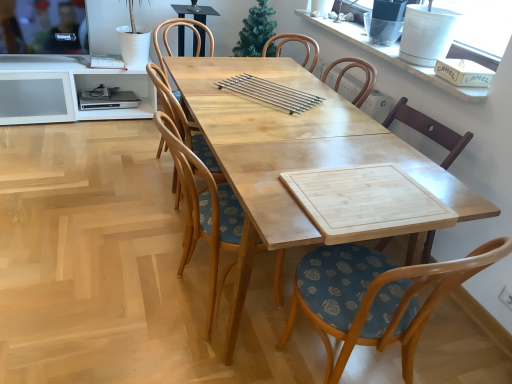
Question: Considering the relative positions of light wood table at center and white ceramic vase at upper right in the image provided, is light wood table at center to the right of white ceramic vase at upper right from the viewer's perspective?

Choices:
 (A) yes
 (B) no

Answer: (B)

Question: Is light wood table at center to the left of white ceramic vase at upper right from the viewer's perspective?

Choices:
 (A) yes
 (B) no

Answer: (A)

Question: Is light wood table at center facing away from white ceramic vase at upper right?

Choices:
 (A) yes
 (B) no

Answer: (B)

Question: Can white ceramic vase at upper right be found inside light wood table at center?

Choices:
 (A) yes
 (B) no

Answer: (B)

Question: Can you confirm if light wood table at center is shorter than white ceramic vase at upper right?

Choices:
 (A) yes
 (B) no

Answer: (B)

Question: In terms of height, does wooden chair with floral cushion at center, which appears as the 3th chair when viewed from the front, look taller or shorter compared to white ceramic vase at upper right?

Choices:
 (A) tall
 (B) short

Answer: (A)

Question: Considering the positions of wooden chair with floral cushion at center, which appears as the 3th chair when viewed from the front, and white ceramic vase at upper right in the image, is wooden chair with floral cushion at center, which appears as the 3th chair when viewed from the front, wider or thinner than white ceramic vase at upper right?

Choices:
 (A) wide
 (B) thin

Answer: (A)

Question: Looking at the image, does wooden chair with floral cushion at center, which appears as the 3th chair when viewed from the front, seem bigger or smaller compared to white ceramic vase at upper right?

Choices:
 (A) big
 (B) small

Answer: (A)

Question: Considering their positions, is wooden chair with floral cushion at center, the first chair in the back-to-front sequence, located in front of or behind white ceramic vase at upper right?

Choices:
 (A) front
 (B) behind

Answer: (B)

Question: From the image's perspective, relative to wooden chair with floral cushion at center, the 2th chair positioned from the back, is wooden chair with floral cushion at center, the first chair in the back-to-front sequence, above or below?

Choices:
 (A) below
 (B) above

Answer: (B)

Question: Is wooden chair with floral cushion at center, the first chair in the back-to-front sequence, inside the boundaries of wooden chair with floral cushion at center, the 2th chair positioned from the back, or outside?

Choices:
 (A) outside
 (B) inside

Answer: (A)

Question: From a real-world perspective, is wooden chair with floral cushion at center, the first chair in the back-to-front sequence, positioned above or below wooden chair with floral cushion at center, the second chair positioned from the front?

Choices:
 (A) above
 (B) below

Answer: (B)

Question: In terms of width, does wooden chair with floral cushion at center, which appears as the 3th chair when viewed from the front, look wider or thinner when compared to wooden chair with floral cushion at center, the second chair positioned from the front?

Choices:
 (A) thin
 (B) wide

Answer: (A)

Question: Relative to wooden chair with floral cushion at center, which is the first chair in front-to-back order, is wooden table at center in front or behind?

Choices:
 (A) front
 (B) behind

Answer: (B)

Question: Is wooden table at center wider or thinner than wooden chair with floral cushion at center, placed as the 3th chair when sorted from back to front?

Choices:
 (A) thin
 (B) wide

Answer: (A)